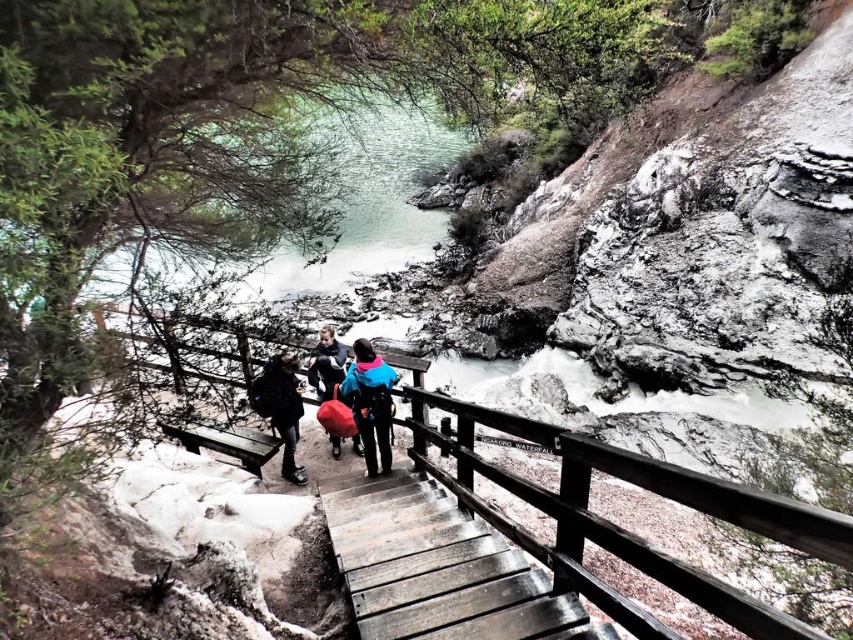
Question: Which of the following is the farthest from the observer?

Choices:
 (A) (308, 368)
 (B) (380, 515)
 (C) (732, 508)
 (D) (370, 394)

Answer: (A)

Question: Observing the image, what is the correct spatial positioning of wooden rail at center in reference to wooden stairs at center?

Choices:
 (A) above
 (B) below

Answer: (A)

Question: In this image, where is wooden stairs at center located relative to matte black jacket at center?

Choices:
 (A) right
 (B) left

Answer: (A)

Question: Considering the relative positions of wooden stairs at center and matte black jacket at center in the image provided, where is wooden stairs at center located with respect to matte black jacket at center?

Choices:
 (A) left
 (B) right

Answer: (B)

Question: Which object appears farthest from the camera in this image?

Choices:
 (A) wooden rail at center
 (B) wooden stairs at center

Answer: (B)

Question: Estimate the real-world distances between objects in this image. Which object is farther from the matte black jacket at center?

Choices:
 (A) wooden rail at center
 (B) wooden stairs at center
 (C) dark gray fabric backpack at center
 (D) blue fleece jacket at center

Answer: (A)